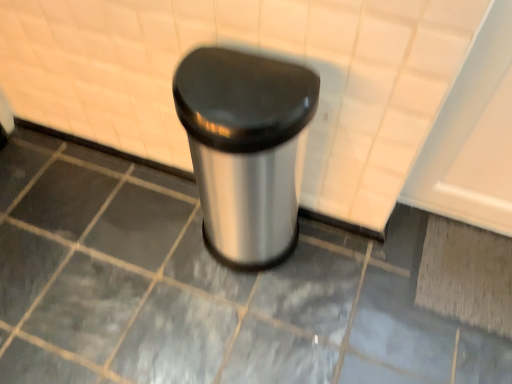
What do you see at coordinates (245, 149) in the screenshot?
I see `polished stainless steel trash can at center` at bounding box center [245, 149].

The height and width of the screenshot is (384, 512). Find the location of `polished stainless steel trash can at center`. polished stainless steel trash can at center is located at coordinates (245, 149).

At what (x,y) coordinates should I click in order to perform the action: click on polished stainless steel trash can at center. Please return your answer as a coordinate pair (x, y). Looking at the image, I should click on (245, 149).